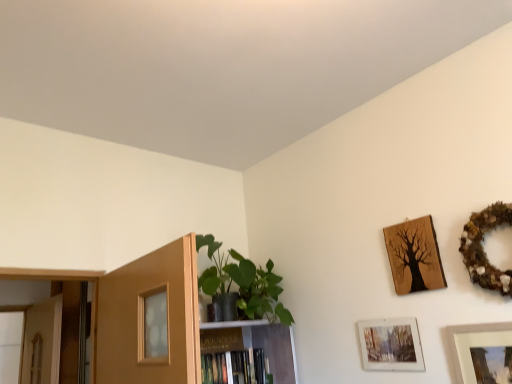
Identify the location of wooden wreath at upper right, acting as the 4th picture frame starting from the bottom. (483, 248).

Image resolution: width=512 pixels, height=384 pixels. What do you see at coordinates (234, 368) in the screenshot?
I see `hardcover book at center` at bounding box center [234, 368].

Describe the element at coordinates (391, 345) in the screenshot. I see `matte glass picture frame at lower right, the 3th picture frame positioned from the top` at that location.

The height and width of the screenshot is (384, 512). What do you see at coordinates (482, 353) in the screenshot?
I see `wooden picture frame at upper right, the 1th picture frame positioned from the bottom` at bounding box center [482, 353].

Find the location of a particular element. This screenshot has height=384, width=512. green matte plant at center is located at coordinates (243, 283).

The width and height of the screenshot is (512, 384). What are the coordinates of `wooden wreath at upper right, acting as the 4th picture frame starting from the bottom` in the screenshot? It's located at [483, 248].

Which is in front, point (240, 358) or point (498, 223)?

The point (498, 223) is more forward.

At what (x,y) coordinates should I click in order to perform the action: click on the 3rd picture frame in front of the hardcover book at center. Please return your answer as a coordinate pair (x, y). The width and height of the screenshot is (512, 384). Looking at the image, I should click on (483, 248).

How far apart are hardcover book at center and wooden wreath at upper right, the first picture frame in the top-to-bottom sequence?

hardcover book at center is 4.13 feet away from wooden wreath at upper right, the first picture frame in the top-to-bottom sequence.

From a real-world perspective, is hardcover book at center positioned under wooden wreath at upper right, the first picture frame in the top-to-bottom sequence, based on gravity?

Yes, from a real-world perspective, hardcover book at center is beneath wooden wreath at upper right, the first picture frame in the top-to-bottom sequence.

Is wooden picture frame at upper right, marked as the fourth picture frame in a top-to-bottom arrangement, looking in the opposite direction of wooden tree art at upper right, placed as the second picture frame when sorted from top to bottom?

wooden picture frame at upper right, marked as the fourth picture frame in a top-to-bottom arrangement, does not have its back to wooden tree art at upper right, placed as the second picture frame when sorted from top to bottom.

Would you say wooden picture frame at upper right, the 1th picture frame positioned from the bottom, is a long distance from wooden tree art at upper right, placed as the second picture frame when sorted from top to bottom?

Actually, wooden picture frame at upper right, the 1th picture frame positioned from the bottom, and wooden tree art at upper right, placed as the second picture frame when sorted from top to bottom, are a little close together.

Can you confirm if wooden picture frame at upper right, the 1th picture frame positioned from the bottom, is shorter than wooden tree art at upper right, acting as the 3th picture frame starting from the bottom?

Incorrect, the height of wooden picture frame at upper right, the 1th picture frame positioned from the bottom, does not fall short of that of wooden tree art at upper right, acting as the 3th picture frame starting from the bottom.

Considering the relative sizes of wooden picture frame at upper right, the 1th picture frame positioned from the bottom, and wooden tree art at upper right, acting as the 3th picture frame starting from the bottom, in the image provided, is wooden picture frame at upper right, the 1th picture frame positioned from the bottom, thinner than wooden tree art at upper right, acting as the 3th picture frame starting from the bottom,?

No, wooden picture frame at upper right, the 1th picture frame positioned from the bottom, is not thinner than wooden tree art at upper right, acting as the 3th picture frame starting from the bottom.

There is a wooden picture frame at upper right, the 1th picture frame positioned from the bottom. What are the coordinates of `the 2nd picture frame above it (from the image's perspective)` in the screenshot? It's located at (414, 256).

From the image's perspective, between wooden tree art at upper right, placed as the second picture frame when sorted from top to bottom, and wooden picture frame at upper right, marked as the fourth picture frame in a top-to-bottom arrangement, who is located below?

wooden picture frame at upper right, marked as the fourth picture frame in a top-to-bottom arrangement.

In terms of size, does wooden tree art at upper right, placed as the second picture frame when sorted from top to bottom, appear bigger or smaller than wooden picture frame at upper right, marked as the fourth picture frame in a top-to-bottom arrangement?

In the image, wooden tree art at upper right, placed as the second picture frame when sorted from top to bottom, appears to be smaller than wooden picture frame at upper right, marked as the fourth picture frame in a top-to-bottom arrangement.

Is the surface of wooden tree art at upper right, acting as the 3th picture frame starting from the bottom, in direct contact with wooden picture frame at upper right, the 1th picture frame positioned from the bottom?

wooden tree art at upper right, acting as the 3th picture frame starting from the bottom, is not next to wooden picture frame at upper right, the 1th picture frame positioned from the bottom, and they're not touching.

From a real-world perspective, who is located lower, matte glass picture frame at lower right, which is the 2th picture frame in bottom-to-top order, or green matte plant at center?

matte glass picture frame at lower right, which is the 2th picture frame in bottom-to-top order, from a real-world perspective.

Is green matte plant at center located within matte glass picture frame at lower right, the 3th picture frame positioned from the top?

Definitely not — green matte plant at center is not inside matte glass picture frame at lower right, the 3th picture frame positioned from the top.

Considering the sizes of objects matte glass picture frame at lower right, the 3th picture frame positioned from the top, and green matte plant at center in the image provided, who is taller, matte glass picture frame at lower right, the 3th picture frame positioned from the top, or green matte plant at center?

With more height is green matte plant at center.

Is wooden tree art at upper right, placed as the second picture frame when sorted from top to bottom, to the right of hardcover book at center from the viewer's perspective?

Yes, wooden tree art at upper right, placed as the second picture frame when sorted from top to bottom, is to the right of hardcover book at center.

From the image's perspective, is wooden tree art at upper right, acting as the 3th picture frame starting from the bottom, over hardcover book at center?

Yes, from the image's perspective, wooden tree art at upper right, acting as the 3th picture frame starting from the bottom, is on top of hardcover book at center.

Looking at this image, from a real-world perspective, which is physically above, wooden tree art at upper right, placed as the second picture frame when sorted from top to bottom, or hardcover book at center?

wooden tree art at upper right, placed as the second picture frame when sorted from top to bottom.

Measure the distance from wooden tree art at upper right, placed as the second picture frame when sorted from top to bottom, to hardcover book at center.

wooden tree art at upper right, placed as the second picture frame when sorted from top to bottom, is 38.79 inches from hardcover book at center.

How different are the orientations of matte glass picture frame at lower right, which is the 2th picture frame in bottom-to-top order, and hardcover book at center in degrees?

90 degrees separate the facing orientations of matte glass picture frame at lower right, which is the 2th picture frame in bottom-to-top order, and hardcover book at center.

Considering the sizes of objects matte glass picture frame at lower right, which is the 2th picture frame in bottom-to-top order, and hardcover book at center in the image provided, who is smaller, matte glass picture frame at lower right, which is the 2th picture frame in bottom-to-top order, or hardcover book at center?

With smaller size is matte glass picture frame at lower right, which is the 2th picture frame in bottom-to-top order.

Between matte glass picture frame at lower right, which is the 2th picture frame in bottom-to-top order, and hardcover book at center, which one has smaller width?

Thinner between the two is matte glass picture frame at lower right, which is the 2th picture frame in bottom-to-top order.

In order to click on the 2nd picture frame positioned above the hardcover book at center (from the image's perspective) in this screenshot , I will do `click(391, 345)`.

What's the angular difference between wooden wreath at upper right, the first picture frame in the top-to-bottom sequence, and hardcover book at center's facing directions?

wooden wreath at upper right, the first picture frame in the top-to-bottom sequence, and hardcover book at center are facing 90 degrees away from each other.

Could you tell me if wooden wreath at upper right, acting as the 4th picture frame starting from the bottom, is facing hardcover book at center?

No.

Are wooden wreath at upper right, acting as the 4th picture frame starting from the bottom, and hardcover book at center far apart?

Yes.

Which object is thinner, wooden wreath at upper right, acting as the 4th picture frame starting from the bottom, or hardcover book at center?

wooden wreath at upper right, acting as the 4th picture frame starting from the bottom, is thinner.

This screenshot has height=384, width=512. I want to click on picture frame that is the 2nd one above the hardcover book at center (from a real-world perspective), so click(x=483, y=248).

Find the location of `the 2nd picture frame positioned above the wooden picture frame at upper right, the 1th picture frame positioned from the bottom (from the image's perspective)`. the 2nd picture frame positioned above the wooden picture frame at upper right, the 1th picture frame positioned from the bottom (from the image's perspective) is located at coordinates (414, 256).

Consider the image. Estimate the real-world distances between objects in this image. Which object is closer to hardcover book at center, wooden wreath at upper right, the first picture frame in the top-to-bottom sequence, or matte glass picture frame at lower right, which is the 2th picture frame in bottom-to-top order?

matte glass picture frame at lower right, which is the 2th picture frame in bottom-to-top order.

From the picture: Considering their positions, is green matte plant at center positioned closer to matte glass picture frame at lower right, which is the 2th picture frame in bottom-to-top order, than hardcover book at center?

green matte plant at center.

Consider the image. From the image, which object appears to be farther from wooden picture frame at upper right, the 1th picture frame positioned from the bottom, matte glass picture frame at lower right, which is the 2th picture frame in bottom-to-top order, or green matte plant at center?

Among the two, green matte plant at center is located further to wooden picture frame at upper right, the 1th picture frame positioned from the bottom.

Looking at this image, estimate the real-world distances between objects in this image. Which object is further from green matte plant at center, matte glass picture frame at lower right, which is the 2th picture frame in bottom-to-top order, or wooden tree art at upper right, placed as the second picture frame when sorted from top to bottom?

wooden tree art at upper right, placed as the second picture frame when sorted from top to bottom.

Based on their spatial positions, is wooden picture frame at upper right, the 1th picture frame positioned from the bottom, or hardcover book at center closer to wooden wreath at upper right, the first picture frame in the top-to-bottom sequence?

wooden picture frame at upper right, the 1th picture frame positioned from the bottom, lies closer to wooden wreath at upper right, the first picture frame in the top-to-bottom sequence, than the other object.

Considering their positions, is wooden wreath at upper right, the first picture frame in the top-to-bottom sequence, positioned further to wooden picture frame at upper right, marked as the fourth picture frame in a top-to-bottom arrangement, than hardcover book at center?

hardcover book at center.

From the image, which object appears to be farther from matte glass picture frame at lower right, the 3th picture frame positioned from the top, wooden tree art at upper right, placed as the second picture frame when sorted from top to bottom, or wooden picture frame at upper right, the 1th picture frame positioned from the bottom?

wooden picture frame at upper right, the 1th picture frame positioned from the bottom, is further to matte glass picture frame at lower right, the 3th picture frame positioned from the top.

From the image, which object appears to be nearer to hardcover book at center, wooden tree art at upper right, acting as the 3th picture frame starting from the bottom, or wooden wreath at upper right, the first picture frame in the top-to-bottom sequence?

Among the two, wooden tree art at upper right, acting as the 3th picture frame starting from the bottom, is located nearer to hardcover book at center.

This screenshot has width=512, height=384. What are the coordinates of `houseplant between hardcover book at center and wooden wreath at upper right, acting as the 4th picture frame starting from the bottom, in the horizontal direction` in the screenshot? It's located at (243, 283).

Where is `picture frame that lies between wooden wreath at upper right, the first picture frame in the top-to-bottom sequence, and matte glass picture frame at lower right, the 3th picture frame positioned from the top, from top to bottom`? picture frame that lies between wooden wreath at upper right, the first picture frame in the top-to-bottom sequence, and matte glass picture frame at lower right, the 3th picture frame positioned from the top, from top to bottom is located at coordinates (414, 256).

You are a GUI agent. You are given a task and a screenshot of the screen. Output one action in this format:
    pyautogui.click(x=<x>, y=<y>)
    Task: Click on the houseplant situated between hardcover book at center and wooden picture frame at upper right, marked as the fourth picture frame in a top-to-bottom arrangement, from left to right
    This screenshot has width=512, height=384.
    Given the screenshot: What is the action you would take?
    (243, 283)

Image resolution: width=512 pixels, height=384 pixels. What are the coordinates of `picture frame situated between hardcover book at center and wooden tree art at upper right, acting as the 3th picture frame starting from the bottom, from left to right` in the screenshot? It's located at (391, 345).